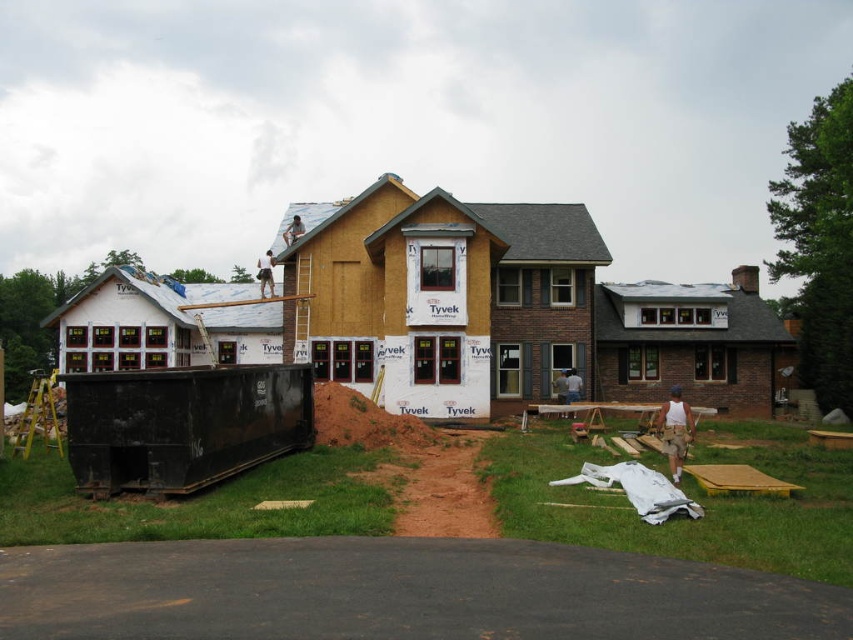
Question: Is tan fabric construction worker at upper center behind tan fabric shirt at lower right?

Choices:
 (A) yes
 (B) no

Answer: (A)

Question: Does tan fabric construction worker at upper center appear over light brown wooden ladder at upper center?

Choices:
 (A) yes
 (B) no

Answer: (A)

Question: Which point is closer to the camera?

Choices:
 (A) (264, 288)
 (B) (300, 227)
 (C) (662, 442)

Answer: (C)

Question: Which point is farther to the camera?

Choices:
 (A) light brown wooden ladder at upper center
 (B) tan fabric shirt at lower right

Answer: (A)

Question: Which object is closer to the camera taking this photo?

Choices:
 (A) tan fabric construction worker at upper center
 (B) tan fabric construction worker at lower right
 (C) tan fabric shirt at lower right
 (D) light brown wooden ladder at upper center

Answer: (B)

Question: Can you confirm if tan fabric construction worker at upper center is positioned to the right of light brown wooden ladder at upper center?

Choices:
 (A) no
 (B) yes

Answer: (A)